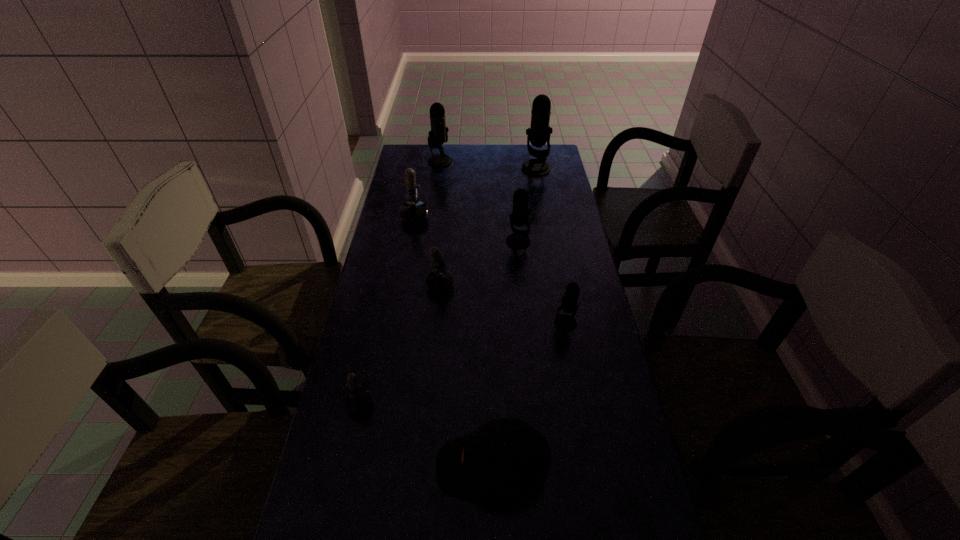
You are a GUI agent. You are given a task and a screenshot of the screen. Output one action in this format:
    pyautogui.click(x=<x>, y=<y>)
    Task: Click on the biggest black microphone
    Image resolution: width=960 pixels, height=540 pixels.
    Given the screenshot: What is the action you would take?
    pyautogui.click(x=538, y=134)

This screenshot has height=540, width=960. Find the location of `the tallest microphone`. the tallest microphone is located at coordinates tap(538, 134).

Locate an element on the screen. The height and width of the screenshot is (540, 960). the second biggest black microphone is located at coordinates (438, 135).

Identify the location of the leftmost black microphone. (438, 135).

Locate an element on the screen. This screenshot has width=960, height=540. the fourth farthest microphone is located at coordinates (519, 239).

The image size is (960, 540). What are the coordinates of `the second nearest black microphone` in the screenshot? It's located at (519, 239).

You are a GUI agent. You are given a task and a screenshot of the screen. Output one action in this format:
    pyautogui.click(x=<x>, y=<y>)
    Task: Click on the farthest white microphone
    This screenshot has width=960, height=540.
    Given the screenshot: What is the action you would take?
    pyautogui.click(x=413, y=210)

This screenshot has width=960, height=540. I want to click on the biggest white microphone, so click(413, 210).

Find the location of a particular element. The height and width of the screenshot is (540, 960). the fifth farthest microphone is located at coordinates (439, 280).

The height and width of the screenshot is (540, 960). What are the coordinates of `the second smallest white microphone` in the screenshot? It's located at (439, 280).